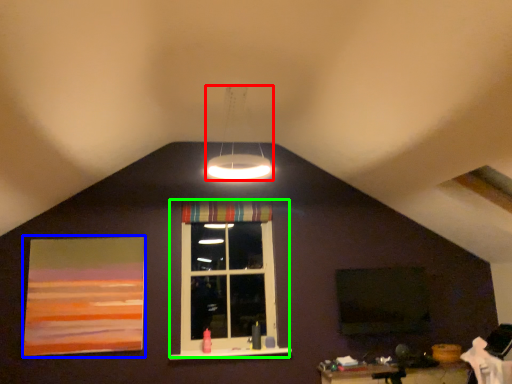
Question: Which is farther away from lamp (highlighted by a red box)? picture frame (highlighted by a blue box) or window (highlighted by a green box)?

Choices:
 (A) picture frame
 (B) window

Answer: (A)